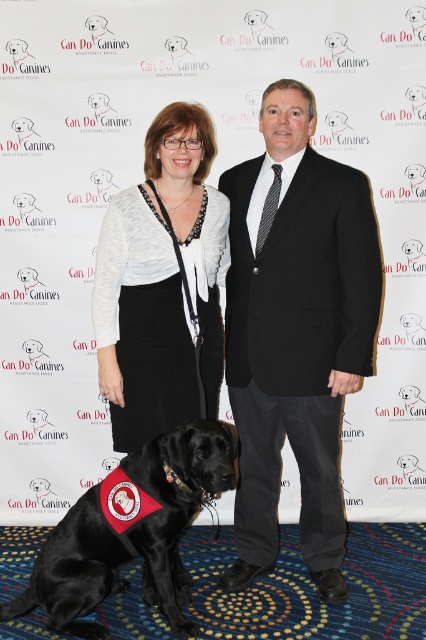
Question: Which object is the farthest from the black fabric dog at center?

Choices:
 (A) black wool suit at center
 (B) matte white blouse at center

Answer: (A)

Question: Does black wool suit at center appear on the right side of black fabric dog at center?

Choices:
 (A) no
 (B) yes

Answer: (B)

Question: Among these points, which one is farthest from the camera?

Choices:
 (A) (x=319, y=232)
 (B) (x=192, y=394)

Answer: (B)

Question: Can you confirm if black wool suit at center is thinner than black fabric dog at center?

Choices:
 (A) yes
 (B) no

Answer: (A)

Question: Which is nearer to the black wool suit at center?

Choices:
 (A) matte white blouse at center
 (B) black fabric dog at center

Answer: (A)

Question: Observing the image, what is the correct spatial positioning of black wool suit at center in reference to matte white blouse at center?

Choices:
 (A) left
 (B) right

Answer: (B)